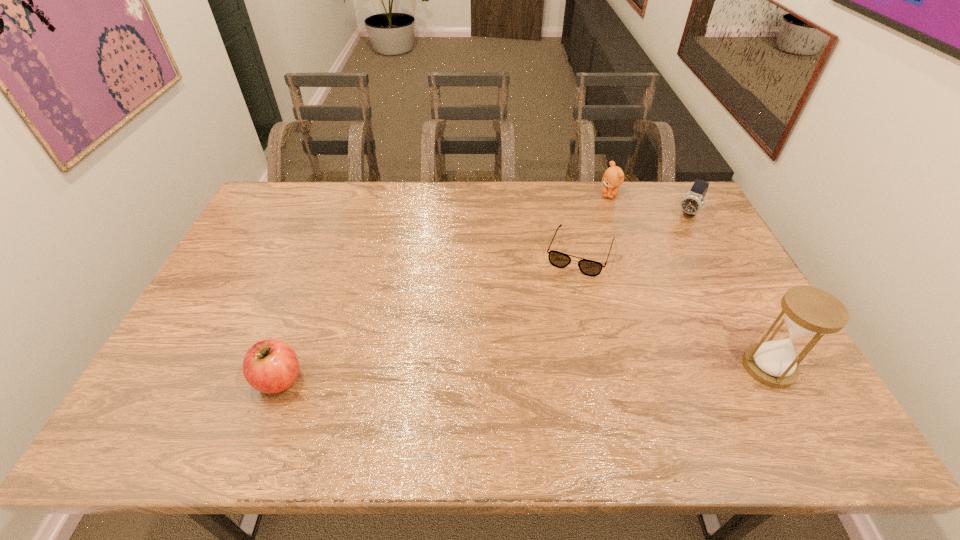
I want to click on vacant space on the desktop that is between the leftmost object and the hourglass and is positioned on the face of the fourth nearest object, so click(x=581, y=372).

Image resolution: width=960 pixels, height=540 pixels. I want to click on free space on the desktop that is between the apple and the hourglass and is positioned on the front-facing side of the fourth object from right to left, so click(x=535, y=373).

Where is `vacant space on the desktop that is between the leftmost object and the hourglass and is positioned on the face of the teddy bear`? vacant space on the desktop that is between the leftmost object and the hourglass and is positioned on the face of the teddy bear is located at coordinates (533, 373).